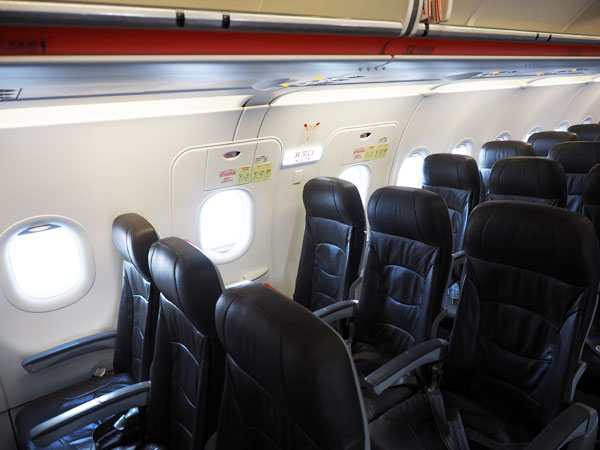
The image size is (600, 450). I want to click on arm rest, so click(x=101, y=404), click(x=77, y=349), click(x=339, y=311), click(x=403, y=363), click(x=551, y=434), click(x=458, y=257).